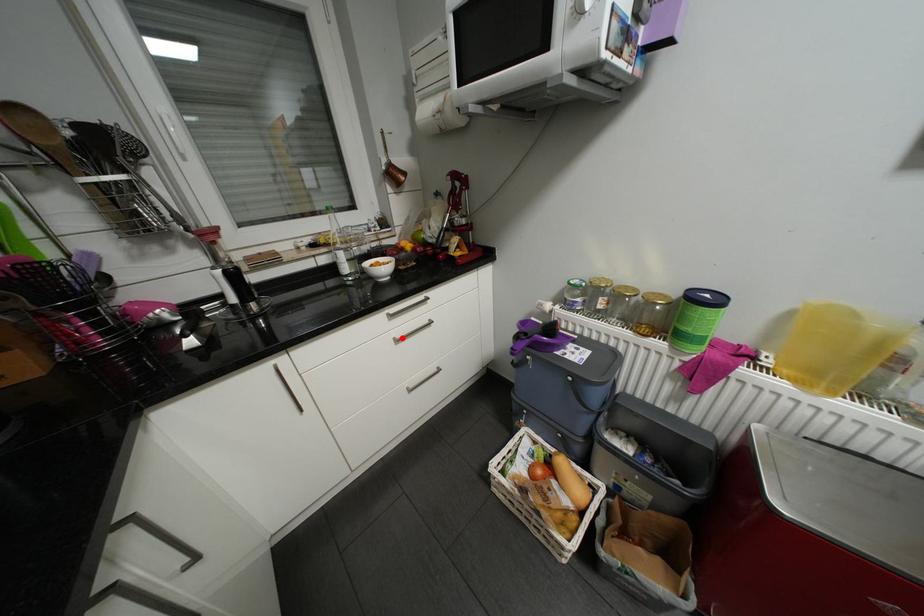
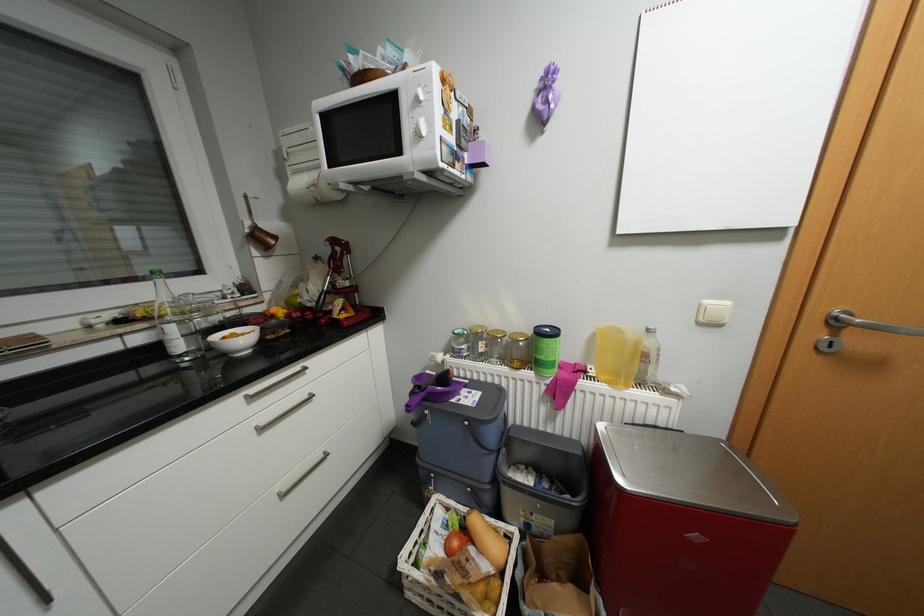
Question: I am providing you with two images of the same scene from different viewpoints. A red point is marked on the first image. At the location where the point appears in image 1, is it still visible in image 2?

Choices:
 (A) Yes
 (B) No

Answer: (A)